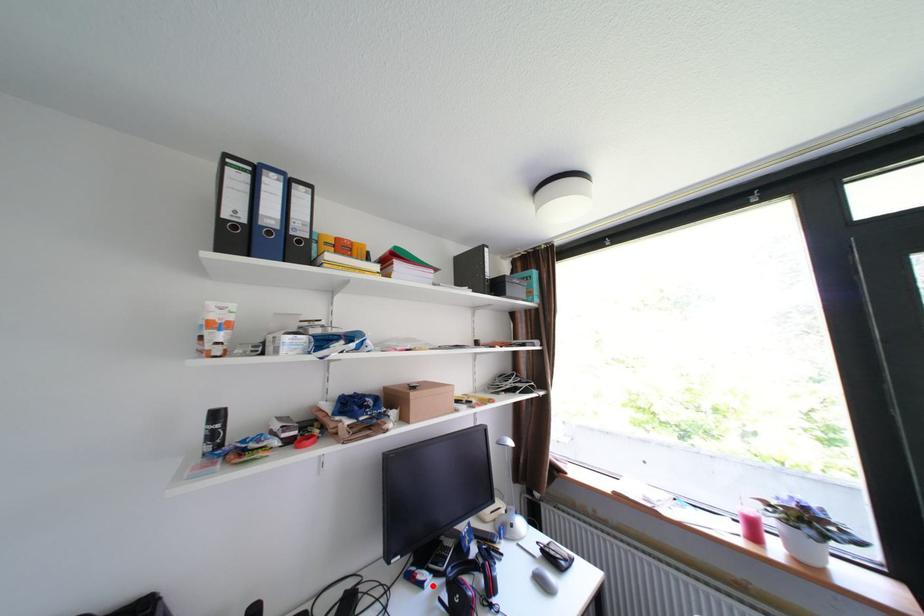
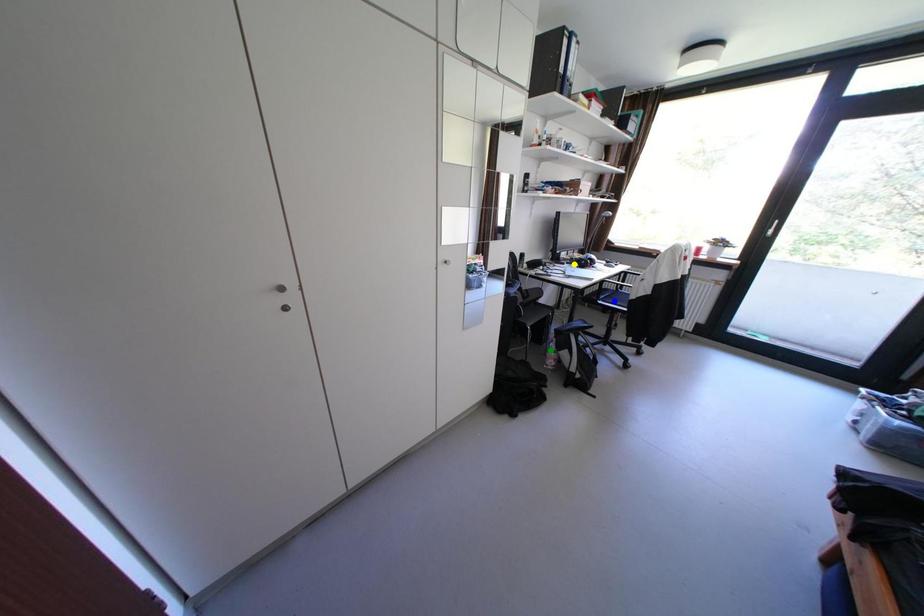
Question: I am providing you with two images of the same scene from different viewpoints. A red point is marked on the first image. You are given multiple points on the second image. Can you choose the point in image 2 that corresponds to the point in image 1?

Choices:
 (A) green point
 (B) blue point
 (C) yellow point

Answer: (C)